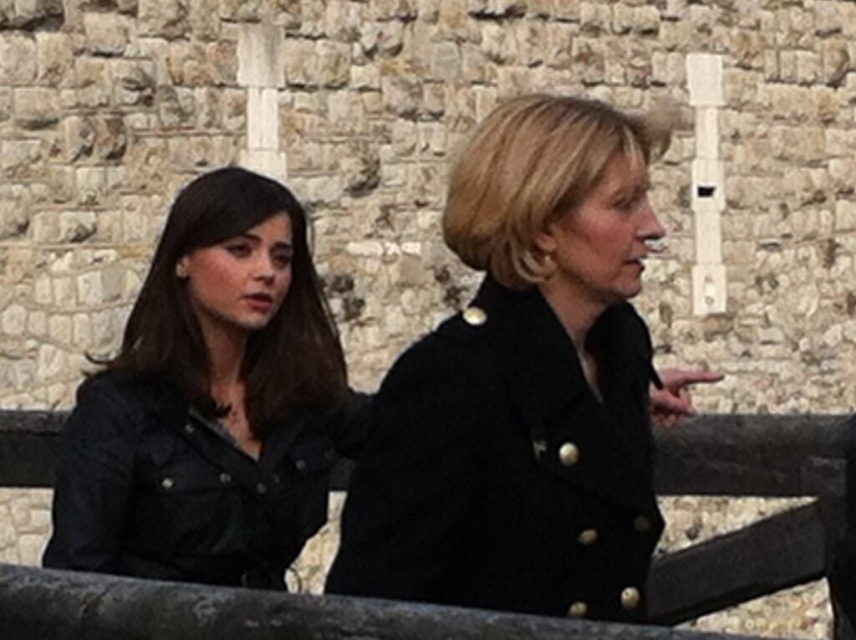
You are a tour guide explaining the historical site to visitors. You want to mention the spatial relationship between the matte black jacket at left and the smooth wooden fence at center. How are they positioned relative to each other?

The smooth wooden fence at center is behind the matte black jacket at left, meaning the matte black jacket at left is closer to the visitors while the smooth wooden fence at center is positioned further back.

You are a photographer trying to capture both the black matte coat at center and the matte black jacket at left in a single frame. Based on their positions, can you determine which one is closer to the camera?

The black matte coat at center is located above the matte black jacket at left, which means it is closer to the camera. Therefore, the black matte coat at center is closer to the camera than the matte black jacket at left.

You are a photographer trying to capture both the black matte coat at center and the matte black jacket at left in a single frame. Based on their positions, which one is located to the right of the other?

The black matte coat at center is positioned on the right side of the matte black jacket at left.